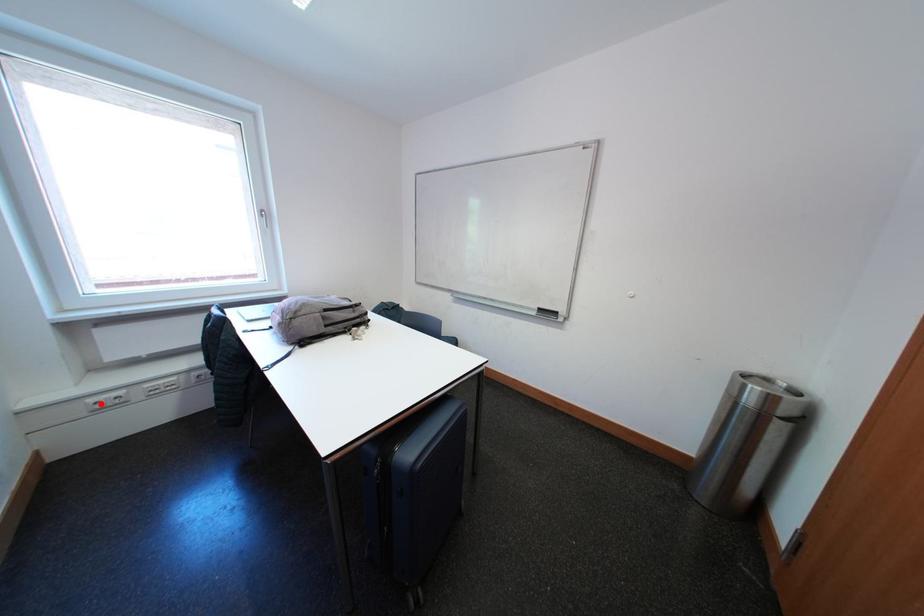
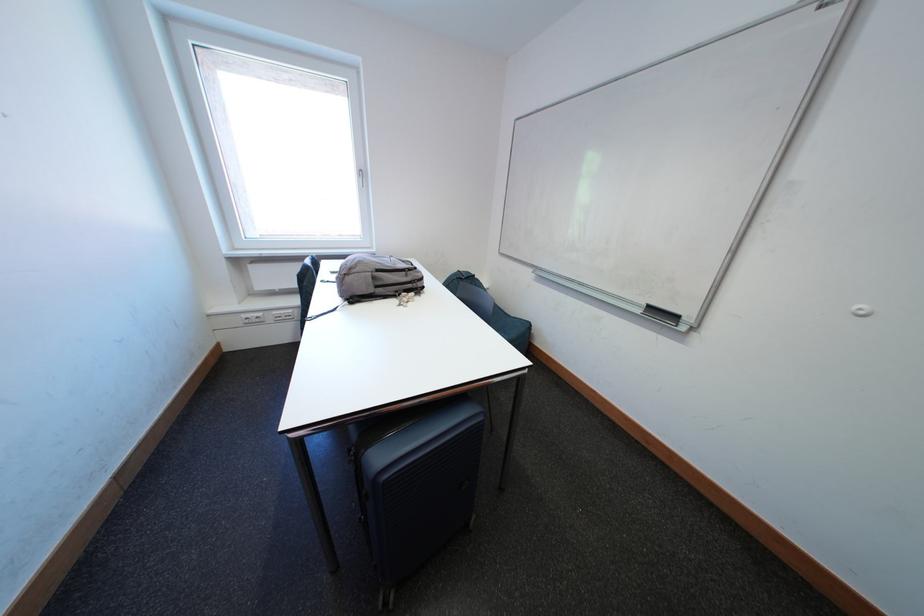
Question: I am providing you with two images of the same scene from different viewpoints. In image1, a red point is highlighted. Considering the same 3D point in image2, which of the following is correct?

Choices:
 (A) It is closer
 (B) It is farther

Answer: (A)